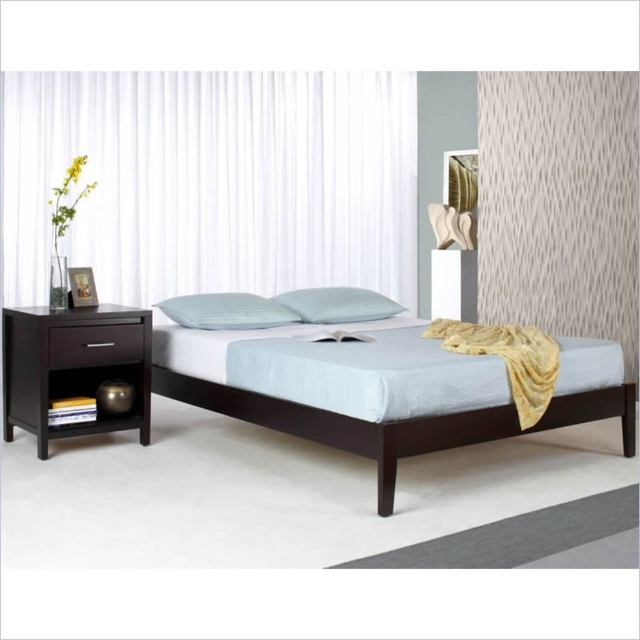
Between point (83, 390) and point (195, 312), which one is positioned in front?

Point (83, 390) is in front.

Between dark wood nightstand at left and white quilted pillow at center, which one has less height?

Standing shorter between the two is white quilted pillow at center.

Which is behind, point (104, 368) or point (236, 305)?

The point (236, 305) is behind.

I want to click on dark wood nightstand at left, so click(74, 365).

Looking at this image, is white quilted pillow at center wider than dark wood drawer at left?

Correct, the width of white quilted pillow at center exceeds that of dark wood drawer at left.

Does white quilted pillow at center have a larger size compared to dark wood drawer at left?

Yes, white quilted pillow at center is bigger than dark wood drawer at left.

Which is in front, point (266, 314) or point (106, 328)?

Point (106, 328) is in front.

You are a GUI agent. You are given a task and a screenshot of the screen. Output one action in this format:
    pyautogui.click(x=<x>, y=<y>)
    Task: Click on the white quilted pillow at center
    
    Given the screenshot: What is the action you would take?
    [227, 310]

Which is below, dark wood bed at center or dark wood nightstand at left?

dark wood bed at center is lower down.

Consider the image. Does dark wood bed at center have a lesser height compared to dark wood nightstand at left?

Correct, dark wood bed at center is not as tall as dark wood nightstand at left.

Is point (285, 364) positioned before point (26, 380)?

Yes, point (285, 364) is in front of point (26, 380).

Find the location of a particular element. dark wood bed at center is located at coordinates (340, 390).